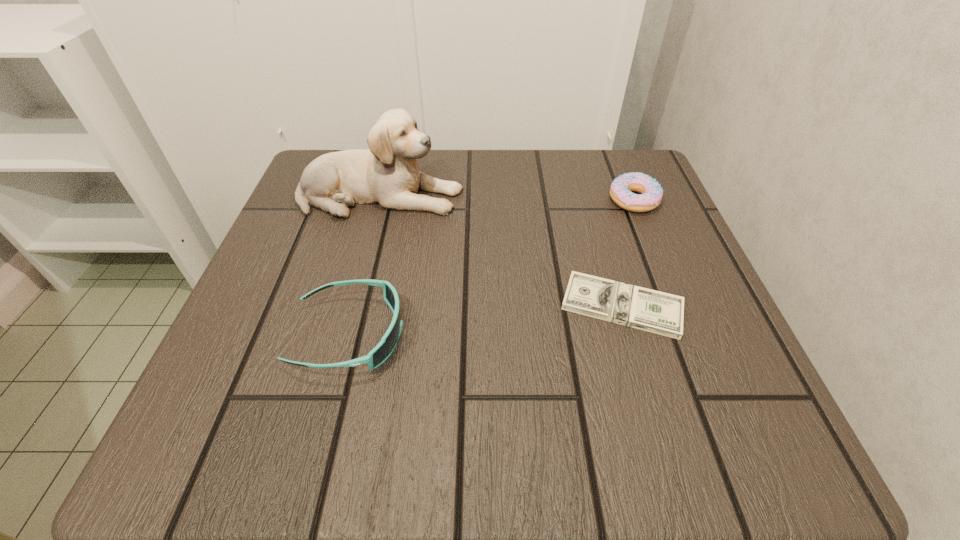
Find the location of a particular element. free space between the second tallest object and the third tallest object is located at coordinates (492, 267).

The width and height of the screenshot is (960, 540). Identify the location of unoccupied position between the dollar and the sunglasses. (486, 320).

The image size is (960, 540). In order to click on free space that is in between the doughnut and the tallest object in this screenshot , I will do `click(507, 198)`.

Find the location of a particular element. This screenshot has width=960, height=540. object that is the closest to the second shortest object is located at coordinates (661, 313).

Locate an element on the screen. object that stands as the second closest to the tallest object is located at coordinates (661, 313).

The width and height of the screenshot is (960, 540). In order to click on vacant position in the image that satisfies the following two spatial constraints: 1. on the front side of the dollar; 2. on the front-facing side of the sunglasses in this screenshot , I will do `click(631, 335)`.